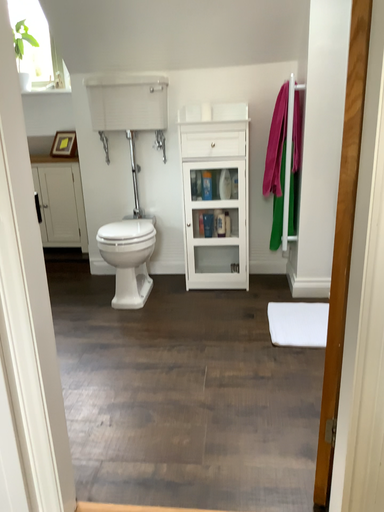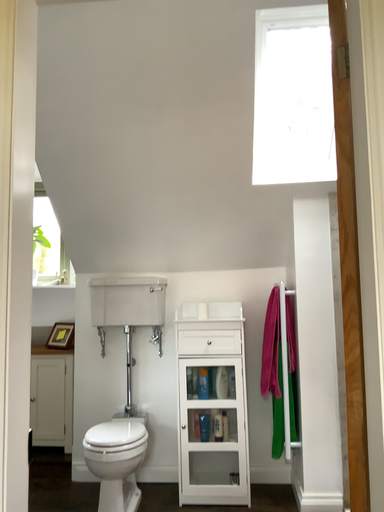
Question: Which way did the camera rotate in the video?

Choices:
 (A) rotated downward
 (B) rotated upward

Answer: (B)